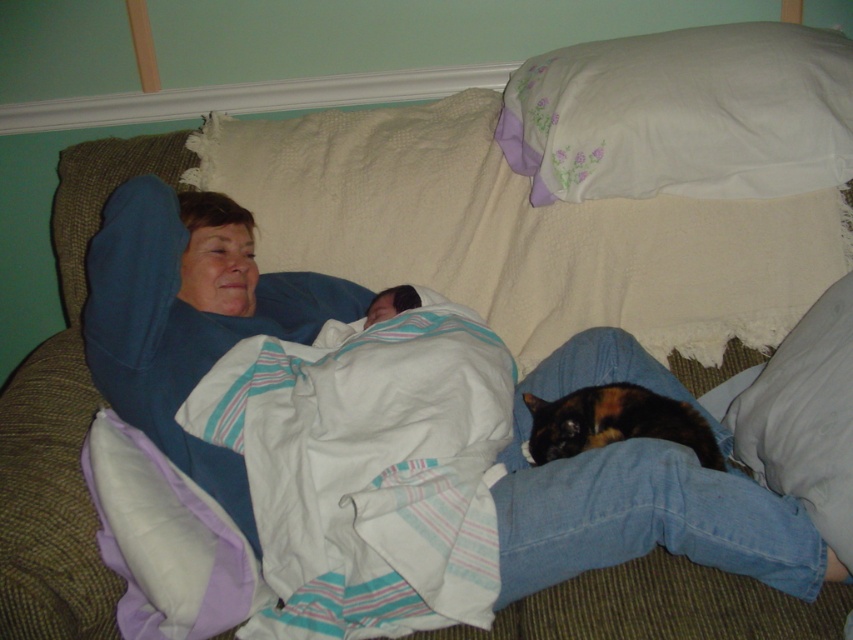
Between white soft pillow at lower right and calico fur cat at lower right, which one has more height?

With more height is white soft pillow at lower right.

Can you confirm if white soft pillow at lower right is taller than calico fur cat at lower right?

Yes, white soft pillow at lower right is taller than calico fur cat at lower right.

Describe the element at coordinates (805, 419) in the screenshot. I see `white soft pillow at lower right` at that location.

Identify the location of white soft pillow at lower right. (805, 419).

In the scene shown: Does white textured blanket at center have a lesser height compared to calico fur cat at lower right?

In fact, white textured blanket at center may be taller than calico fur cat at lower right.

Consider the image. Does white textured blanket at center have a smaller size compared to calico fur cat at lower right?

Actually, white textured blanket at center might be larger than calico fur cat at lower right.

Locate an element on the screen. The height and width of the screenshot is (640, 853). white textured blanket at center is located at coordinates (519, 230).

Who is positioned more to the right, white textured blanket at center or white cotton pillow at upper right?

white cotton pillow at upper right is more to the right.

Between white textured blanket at center and white cotton pillow at upper right, which one is positioned higher?

white cotton pillow at upper right is above.

Locate an element on the screen. The height and width of the screenshot is (640, 853). white textured blanket at center is located at coordinates (519, 230).

What are the coordinates of `white textured blanket at center` in the screenshot? It's located at (519, 230).